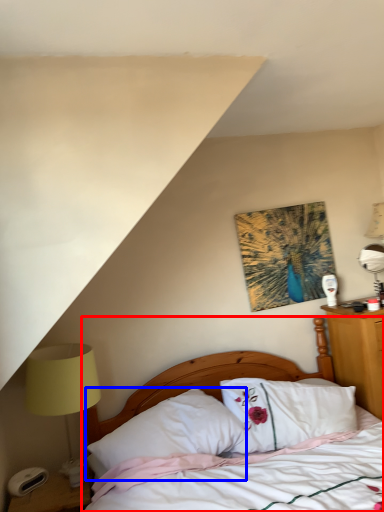
Question: Which object appears farthest to the camera in this image, bed (highlighted by a red box) or pillow (highlighted by a blue box)?

Choices:
 (A) bed
 (B) pillow

Answer: (B)